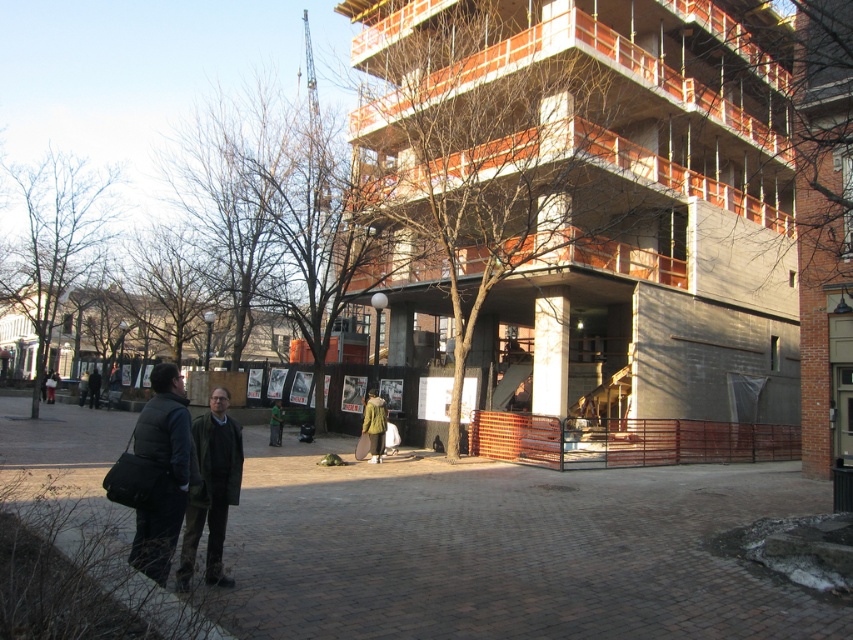
In the scene shown: Between green fuzzy coat at center and green fabric jacket at center, which one has more height?

Standing taller between the two is green fuzzy coat at center.

At what (x,y) coordinates should I click in order to perform the action: click on green fuzzy coat at center. Please return your answer as a coordinate pair (x, y). Looking at the image, I should click on (375, 424).

Which is in front, point (376, 403) or point (277, 408)?

Point (376, 403)

You are a GUI agent. You are given a task and a screenshot of the screen. Output one action in this format:
    pyautogui.click(x=<x>, y=<y>)
    Task: Click on the green fuzzy coat at center
    
    Given the screenshot: What is the action you would take?
    pyautogui.click(x=375, y=424)

Does brown wooden tree at upper center appear over bare branches at left?

Correct, brown wooden tree at upper center is located above bare branches at left.

The width and height of the screenshot is (853, 640). What do you see at coordinates (822, 141) in the screenshot? I see `brown wooden tree at upper center` at bounding box center [822, 141].

The height and width of the screenshot is (640, 853). I want to click on brown wooden tree at upper center, so click(822, 141).

The image size is (853, 640). In order to click on brown wooden tree at upper center in this screenshot , I will do `click(822, 141)`.

Is bare branches at left behind dark gray jacket at lower left?

That is False.

Can you confirm if bare branches at left is positioned to the left of dark gray jacket at lower left?

Yes, bare branches at left is to the left of dark gray jacket at lower left.

Is point (102, 241) positioned behind point (50, 392)?

No.

The width and height of the screenshot is (853, 640). Identify the location of bare branches at left. (53, 241).